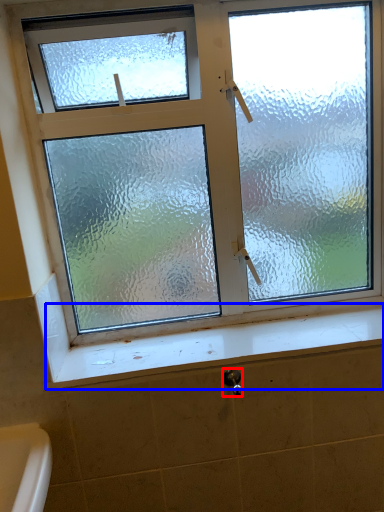
Question: Which point is closer to the camera, shower (highlighted by a red box) or window sill (highlighted by a blue box)?

Choices:
 (A) shower
 (B) window sill

Answer: (A)